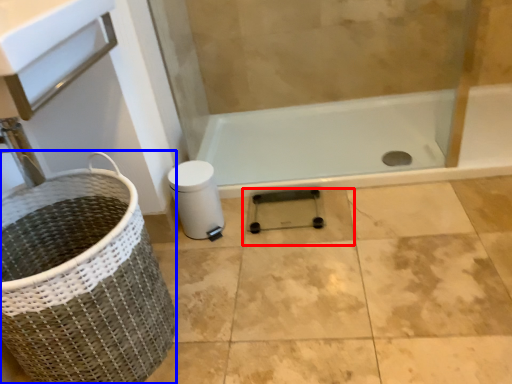
Question: Among these objects, which one is nearest to the camera, tile (highlighted by a red box) or basket container (highlighted by a blue box)?

Choices:
 (A) tile
 (B) basket container

Answer: (B)